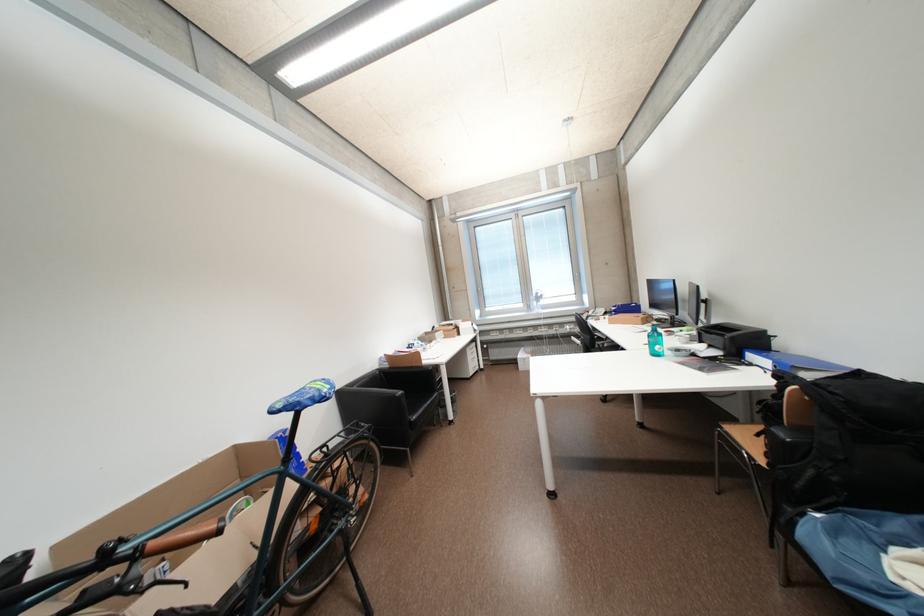
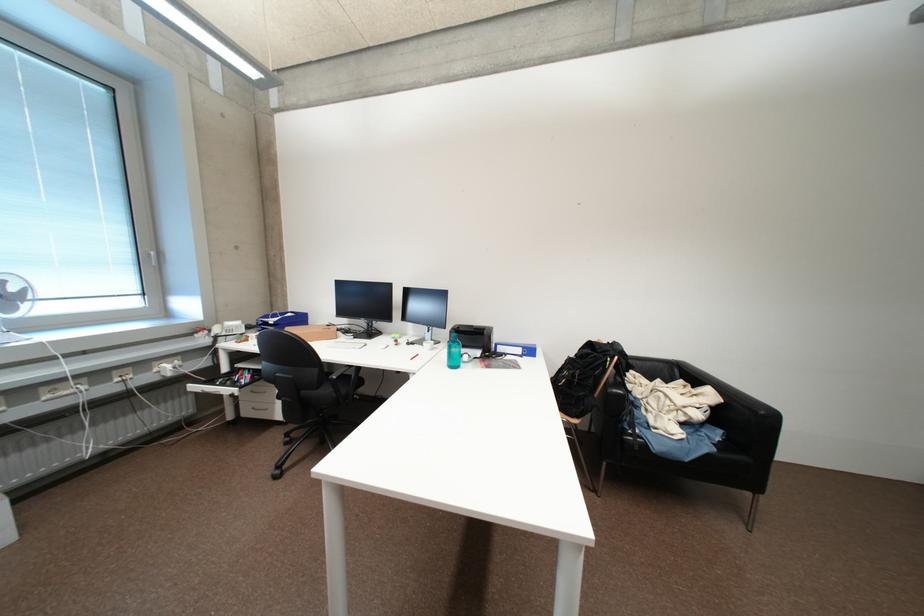
Question: I am providing you with two images of the same scene from different viewpoints. Which of the following objects are not visible in image2?

Choices:
 (A) wooden chair sitting surface
 (B) chair armrest
 (C) red book
 (D) drawer handle

Answer: (A)